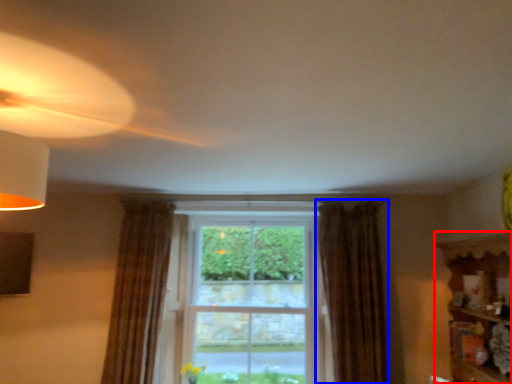
Question: Which object appears closest to the camera in this image, shelf (highlighted by a red box) or curtain (highlighted by a blue box)?

Choices:
 (A) shelf
 (B) curtain

Answer: (A)